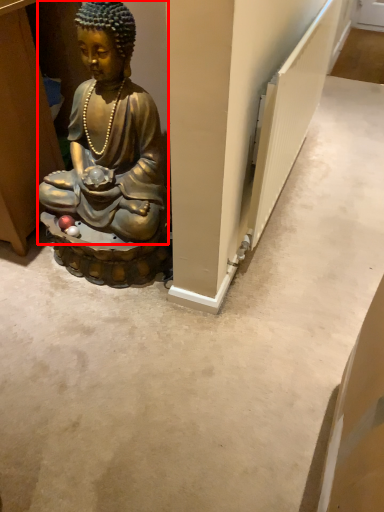
Question: Observing the image, what is the correct spatial positioning of person (annotated by the red box) in reference to radiator?

Choices:
 (A) right
 (B) left

Answer: (B)